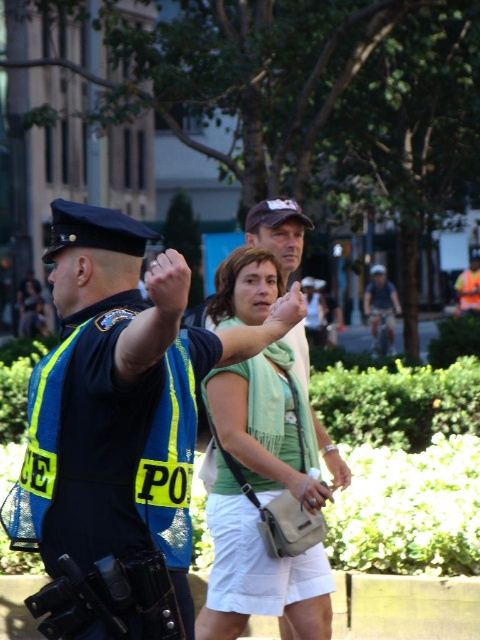
You are standing at the origin point in the park scene. The police officer is directing you to a specific location. According to the coordinates provided, where is the matte green shirt at center located relative to your current position?

The matte green shirt at center is located at coordinates point (119, 428) relative to your current position.

You are a photographer trying to capture a clear shot of the matte green shirt at center and the green fabric scarf at center. Since both are green, you need to adjust your camera focus to ensure one is in focus while the other is blurred. Which object should you focus on to make the other appear out of focus?

You should focus on the matte green shirt at center because it is in front of the green fabric scarf at center. By focusing on the foreground object, the background object will naturally appear more blurred.

You are a photographer trying to capture a candid shot of the woman with the matte green shirt at center and the green fabric scarf at center. Since you want to ensure both are in frame, can you tell me which object is positioned to the left of the other?

The matte green shirt at center is to the left of the green fabric scarf at center.